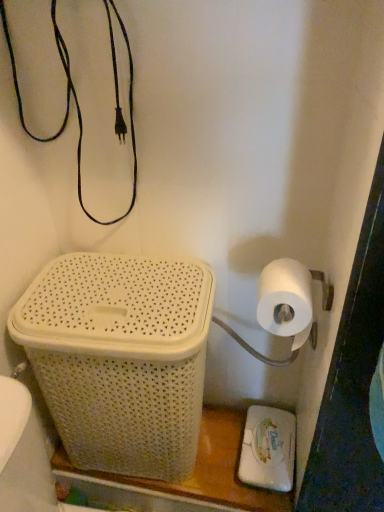
Question: Is white wicker basket at lower left at the right side of white matte toilet paper at right?

Choices:
 (A) yes
 (B) no

Answer: (B)

Question: Is white wicker basket at lower left taller than white matte toilet paper at right?

Choices:
 (A) yes
 (B) no

Answer: (A)

Question: Considering the relative positions of white wicker basket at lower left and white matte toilet paper at right in the image provided, is white wicker basket at lower left to the left of white matte toilet paper at right from the viewer's perspective?

Choices:
 (A) no
 (B) yes

Answer: (B)

Question: From the image's perspective, is white wicker basket at lower left below white matte toilet paper at right?

Choices:
 (A) no
 (B) yes

Answer: (B)

Question: Is white wicker basket at lower left not inside white matte toilet paper at right?

Choices:
 (A) yes
 (B) no

Answer: (A)

Question: Can you confirm if white wicker basket at lower left is shorter than white matte toilet paper at right?

Choices:
 (A) yes
 (B) no

Answer: (B)

Question: Can you confirm if white wicker basket at lower left is shorter than white matte toilet paper at right?

Choices:
 (A) yes
 (B) no

Answer: (B)

Question: Is white wicker basket at lower left facing away from white matte toilet paper at right?

Choices:
 (A) yes
 (B) no

Answer: (B)

Question: Is white matte toilet paper at right located within white wicker basket at lower left?

Choices:
 (A) yes
 (B) no

Answer: (B)

Question: Does white wicker basket at lower left appear on the right side of white matte toilet paper at right?

Choices:
 (A) no
 (B) yes

Answer: (A)

Question: Does white wicker basket at lower left have a lesser width compared to white matte toilet paper at right?

Choices:
 (A) no
 (B) yes

Answer: (A)

Question: Is white wicker basket at lower left positioned beyond the bounds of white matte toilet paper at right?

Choices:
 (A) no
 (B) yes

Answer: (B)

Question: Is white matte toilet paper at right turned away from white wicker basket at lower left?

Choices:
 (A) no
 (B) yes

Answer: (A)